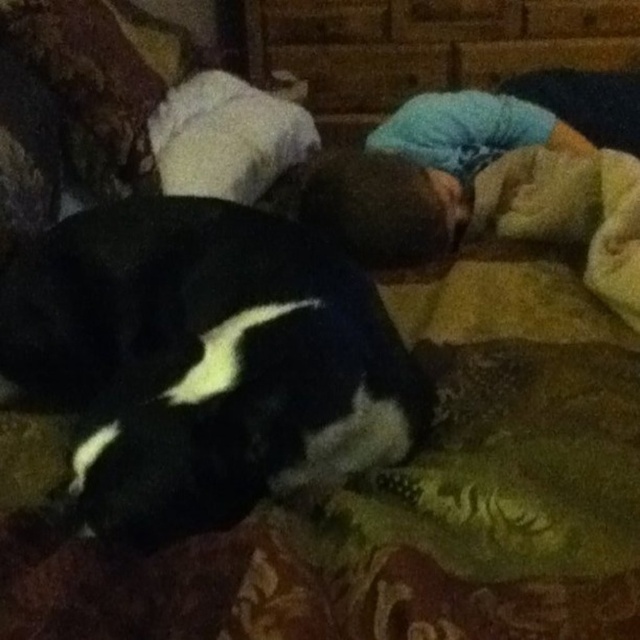
Does black and white fur at center have a smaller size compared to blue cotton shirt at center?

Yes.

Is black and white fur at center taller than blue cotton shirt at center?

In fact, black and white fur at center may be shorter than blue cotton shirt at center.

At what (x,y) coordinates should I click in order to perform the action: click on black and white fur at center. Please return your answer as a coordinate pair (x, y). This screenshot has height=640, width=640. Looking at the image, I should click on (204, 360).